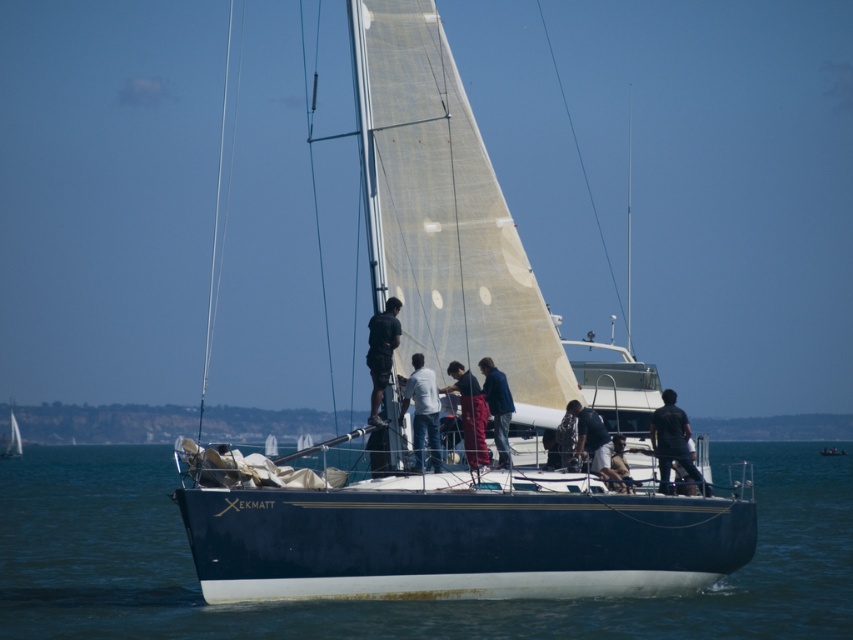
Can you confirm if blue glossy sailboat at center is positioned below blue water at center?

No.

Who is lower down, blue glossy sailboat at center or blue water at center?

blue water at center

The image size is (853, 640). I want to click on blue glossy sailboat at center, so click(x=440, y=380).

Find the location of `blue glossy sailboat at center`. blue glossy sailboat at center is located at coordinates (440, 380).

Can you confirm if blue water at center is positioned to the right of blue fabric jacket at center?

In fact, blue water at center is to the left of blue fabric jacket at center.

Does blue water at center have a lesser height compared to blue fabric jacket at center?

Incorrect, blue water at center's height does not fall short of blue fabric jacket at center's.

Is point (15, 522) positioned after point (492, 410)?

Yes, point (15, 522) is behind point (492, 410).

The image size is (853, 640). I want to click on blue water at center, so click(390, 600).

Can you confirm if blue glossy sailboat at center is shorter than blue fabric jacket at center?

No, blue glossy sailboat at center is not shorter than blue fabric jacket at center.

Can you confirm if blue glossy sailboat at center is thinner than blue fabric jacket at center?

No.

Between point (479, 520) and point (503, 451), which one is positioned behind?

The point (503, 451) is more distant.

Image resolution: width=853 pixels, height=640 pixels. What are the coordinates of `blue glossy sailboat at center` in the screenshot? It's located at (440, 380).